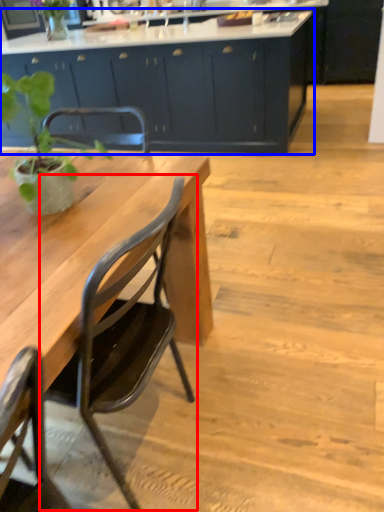
Question: Which point is further to the camera, chair (highlighted by a red box) or cabinetry (highlighted by a blue box)?

Choices:
 (A) chair
 (B) cabinetry

Answer: (B)